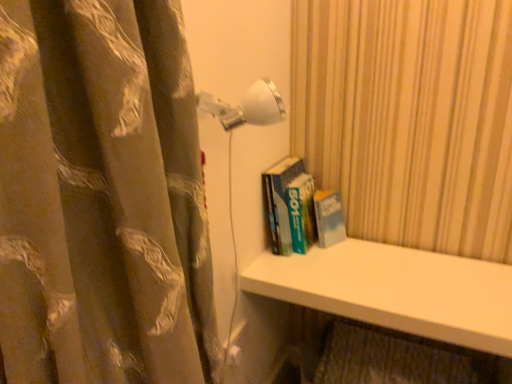
Describe the element at coordinates (396, 290) in the screenshot. The height and width of the screenshot is (384, 512). I see `white smooth shelf at lower center` at that location.

This screenshot has width=512, height=384. I want to click on brown floral fabric curtain at left, so click(102, 197).

Find the location of a particular element. The image size is (512, 384). white smooth shelf at lower center is located at coordinates (396, 290).

Considering the relative positions of white smooth shelf at lower center and white glossy wall lamp at upper center in the image provided, is white smooth shelf at lower center behind white glossy wall lamp at upper center?

Yes, white smooth shelf at lower center is behind white glossy wall lamp at upper center.

Does white smooth shelf at lower center appear on the right side of white glossy wall lamp at upper center?

Correct, you'll find white smooth shelf at lower center to the right of white glossy wall lamp at upper center.

Is white smooth shelf at lower center positioned with its back to white glossy wall lamp at upper center?

No, white glossy wall lamp at upper center is not at the back of white smooth shelf at lower center.

From a real-world perspective, is white smooth shelf at lower center on top of white glossy wall lamp at upper center?

No, from a real-world perspective, white smooth shelf at lower center is not above white glossy wall lamp at upper center.

From a real-world perspective, is white glossy wall lamp at upper center above or below brown floral fabric curtain at left?

white glossy wall lamp at upper center is above brown floral fabric curtain at left.

Would you say white glossy wall lamp at upper center contains brown floral fabric curtain at left?

No, brown floral fabric curtain at left is not a part of white glossy wall lamp at upper center.

Considering the sizes of objects white glossy wall lamp at upper center and brown floral fabric curtain at left in the image provided, who is bigger, white glossy wall lamp at upper center or brown floral fabric curtain at left?

brown floral fabric curtain at left is bigger.

Considering the sizes of white glossy wall lamp at upper center and brown floral fabric curtain at left in the image, is white glossy wall lamp at upper center taller or shorter than brown floral fabric curtain at left?

Clearly, white glossy wall lamp at upper center is shorter compared to brown floral fabric curtain at left.

Which of these two, hardcover book at center or brown floral fabric curtain at left, is smaller?

hardcover book at center is smaller.

Consider the image. Considering the relative sizes of hardcover book at center and brown floral fabric curtain at left in the image provided, is hardcover book at center taller than brown floral fabric curtain at left?

Incorrect, the height of hardcover book at center is not larger of that of brown floral fabric curtain at left.

In the scene shown: What's the angular difference between hardcover book at center and brown floral fabric curtain at left's facing directions?

90 degrees separate the facing orientations of hardcover book at center and brown floral fabric curtain at left.

Does hardcover book at center come behind brown floral fabric curtain at left?

Yes, hardcover book at center is further from the camera.

Can you confirm if white smooth shelf at lower center is bigger than brown floral fabric curtain at left?

Yes.

Measure the distance between white smooth shelf at lower center and brown floral fabric curtain at left.

white smooth shelf at lower center and brown floral fabric curtain at left are 29.47 inches apart.

Between white smooth shelf at lower center and brown floral fabric curtain at left, which one has larger width?

white smooth shelf at lower center is wider.

Is the surface of white smooth shelf at lower center in direct contact with brown floral fabric curtain at left?

No, white smooth shelf at lower center is not making contact with brown floral fabric curtain at left.

From a real-world perspective, who is located lower, hardcover book at center or white glossy wall lamp at upper center?

hardcover book at center.

Who is more distant, hardcover book at center or white glossy wall lamp at upper center?

hardcover book at center.

Which is in front, point (313, 219) or point (228, 107)?

The point (228, 107) is closer.

Who is bigger, hardcover book at center or white glossy wall lamp at upper center?

hardcover book at center.

From the picture: Considering their positions, is white smooth shelf at lower center located in front of or behind hardcover book at center?

Visually, white smooth shelf at lower center is located in front of hardcover book at center.

Which object is wider, white smooth shelf at lower center or hardcover book at center?

Wider between the two is white smooth shelf at lower center.

Is white smooth shelf at lower center to the left or to the right of hardcover book at center in the image?

In the image, white smooth shelf at lower center appears on the right side of hardcover book at center.

Are white smooth shelf at lower center and hardcover book at center making contact?

white smooth shelf at lower center is not next to hardcover book at center, and they're not touching.

Considering the relative positions of brown floral fabric curtain at left and white glossy wall lamp at upper center in the image provided, is brown floral fabric curtain at left to the left or to the right of white glossy wall lamp at upper center?

brown floral fabric curtain at left is to the left of white glossy wall lamp at upper center.

Is brown floral fabric curtain at left far away from white glossy wall lamp at upper center?

brown floral fabric curtain at left is actually quite close to white glossy wall lamp at upper center.

Which of these two, brown floral fabric curtain at left or white glossy wall lamp at upper center, is smaller?

Smaller between the two is white glossy wall lamp at upper center.

Where is `lamp above the white smooth shelf at lower center (from a real-world perspective)`? Image resolution: width=512 pixels, height=384 pixels. lamp above the white smooth shelf at lower center (from a real-world perspective) is located at coordinates (246, 106).

Where is `curtain lying in front of the white glossy wall lamp at upper center`? The image size is (512, 384). curtain lying in front of the white glossy wall lamp at upper center is located at coordinates (102, 197).

Looking at the image, which one is located closer to white smooth shelf at lower center, hardcover book at center or brown floral fabric curtain at left?

hardcover book at center is closer to white smooth shelf at lower center.

From the image, which object appears to be nearer to hardcover book at center, white glossy wall lamp at upper center or white smooth shelf at lower center?

Among the two, white smooth shelf at lower center is located nearer to hardcover book at center.

Considering their positions, is white glossy wall lamp at upper center positioned further to white smooth shelf at lower center than hardcover book at center?

The object further to white smooth shelf at lower center is white glossy wall lamp at upper center.

Based on their spatial positions, is white glossy wall lamp at upper center or brown floral fabric curtain at left further from hardcover book at center?

Among the two, brown floral fabric curtain at left is located further to hardcover book at center.

Considering their positions, is white glossy wall lamp at upper center positioned further to brown floral fabric curtain at left than hardcover book at center?

hardcover book at center.

When comparing their distances from white glossy wall lamp at upper center, does white smooth shelf at lower center or brown floral fabric curtain at left seem closer?

Among the two, brown floral fabric curtain at left is located nearer to white glossy wall lamp at upper center.

Estimate the real-world distances between objects in this image. Which object is further from brown floral fabric curtain at left, white smooth shelf at lower center or hardcover book at center?

hardcover book at center is positioned further to the anchor brown floral fabric curtain at left.

When comparing their distances from white glossy wall lamp at upper center, does brown floral fabric curtain at left or hardcover book at center seem closer?

hardcover book at center.

Identify the location of lamp positioned between brown floral fabric curtain at left and hardcover book at center from near to far. The image size is (512, 384). (246, 106).

You are a GUI agent. You are given a task and a screenshot of the screen. Output one action in this format:
    pyautogui.click(x=<x>, y=<y>)
    Task: Click on the window sill between brown floral fabric curtain at left and hardcover book at center along the z-axis
    The width and height of the screenshot is (512, 384).
    Given the screenshot: What is the action you would take?
    pyautogui.click(x=396, y=290)

At what (x,y) coordinates should I click in order to perform the action: click on curtain between white glossy wall lamp at upper center and white smooth shelf at lower center in the up-down direction. Please return your answer as a coordinate pair (x, y). Looking at the image, I should click on (102, 197).

Find the location of a particular element. book that lies between white glossy wall lamp at upper center and white smooth shelf at lower center from top to bottom is located at coordinates (300, 209).